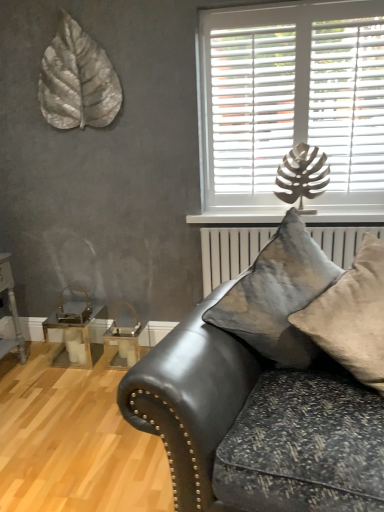
Question: Would you say clear glass table at lower left, which appears as the first table when viewed from the right, is inside or outside metallic silver leaf at upper left?

Choices:
 (A) inside
 (B) outside

Answer: (B)

Question: From the image's perspective, relative to metallic silver leaf at upper left, is clear glass table at lower left, the second table in the left-to-right sequence, above or below?

Choices:
 (A) below
 (B) above

Answer: (A)

Question: Which object is positioned farthest from the metallic silver leaf at upper left?

Choices:
 (A) metallic gold table at lower left, placed as the second table when sorted from right to left
 (B) white plastic blinds at upper right
 (C) clear glass table at lower left, the second table in the left-to-right sequence
 (D) velvet gray pillow at center, the first pillow positioned from the left
 (E) leather couch at lower right

Answer: (E)

Question: Estimate the real-world distances between objects in this image. Which object is farther from the white plastic blinds at upper right?

Choices:
 (A) leather couch at lower right
 (B) velvet gray pillow at center, which is the 2th pillow in right-to-left order
 (C) metallic silver leaf at upper left
 (D) metallic gold table at lower left, which is counted as the first table, starting from the left
 (E) clear glass table at lower left, which appears as the first table when viewed from the right

Answer: (D)